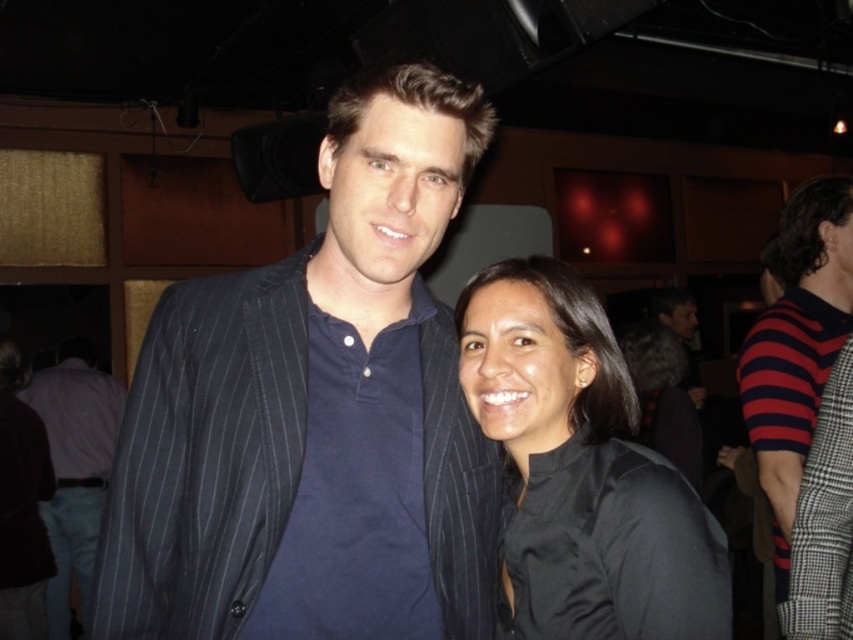
Looking at this image, does dark blue pinstripe suit at center have a lesser width compared to black matte shirt at center?

In fact, dark blue pinstripe suit at center might be wider than black matte shirt at center.

Which of these two, dark blue pinstripe suit at center or black matte shirt at center, stands shorter?

Standing shorter between the two is black matte shirt at center.

What do you see at coordinates (315, 413) in the screenshot? The image size is (853, 640). I see `dark blue pinstripe suit at center` at bounding box center [315, 413].

What are the coordinates of `dark blue pinstripe suit at center` in the screenshot? It's located at (315, 413).

Which is more to the right, dark blue pinstripe suit at center or red and navy striped sweater at right?

red and navy striped sweater at right

Which is above, dark blue pinstripe suit at center or red and navy striped sweater at right?

Positioned higher is dark blue pinstripe suit at center.

Identify the location of dark blue pinstripe suit at center. The height and width of the screenshot is (640, 853). (315, 413).

This screenshot has width=853, height=640. What are the coordinates of `dark blue pinstripe suit at center` in the screenshot? It's located at (315, 413).

Does point (663, 461) come farther from viewer compared to point (791, 211)?

No, (663, 461) is closer to viewer.

In order to click on black matte shirt at center in this screenshot , I will do `click(582, 470)`.

Which is behind, point (473, 324) or point (780, 374)?

The point (780, 374) is more distant.

Image resolution: width=853 pixels, height=640 pixels. Find the location of `black matte shirt at center`. black matte shirt at center is located at coordinates (582, 470).